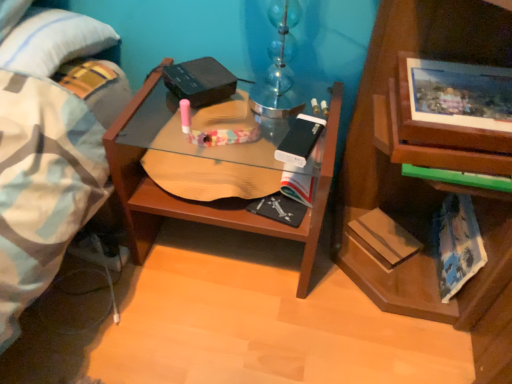
At what (x,y) coordinates should I click in order to perform the action: click on vacant area in front of hardcover book at lower right, the second paperback book in the left-to-right sequence. Please return your answer as a coordinate pair (x, y). This screenshot has width=512, height=384. Looking at the image, I should click on [x=378, y=314].